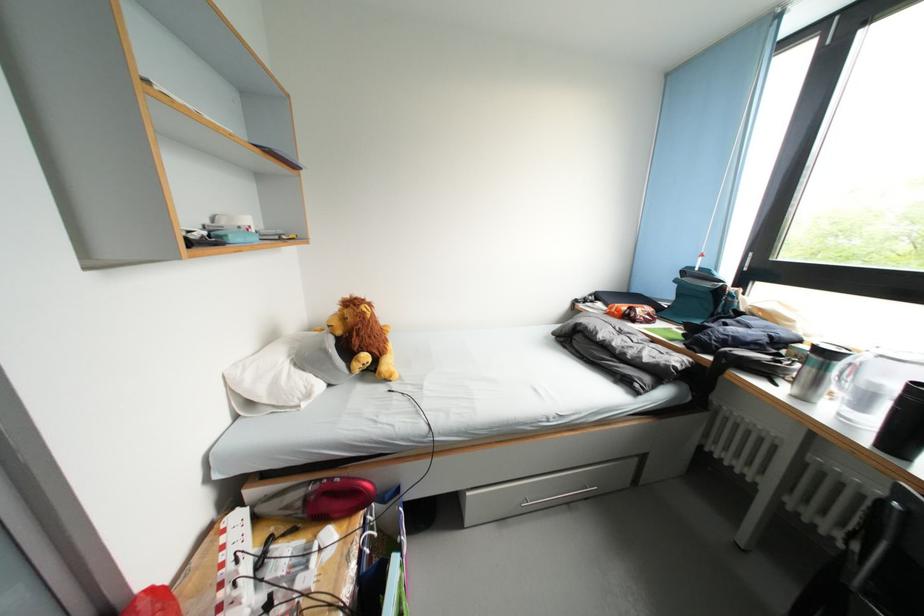
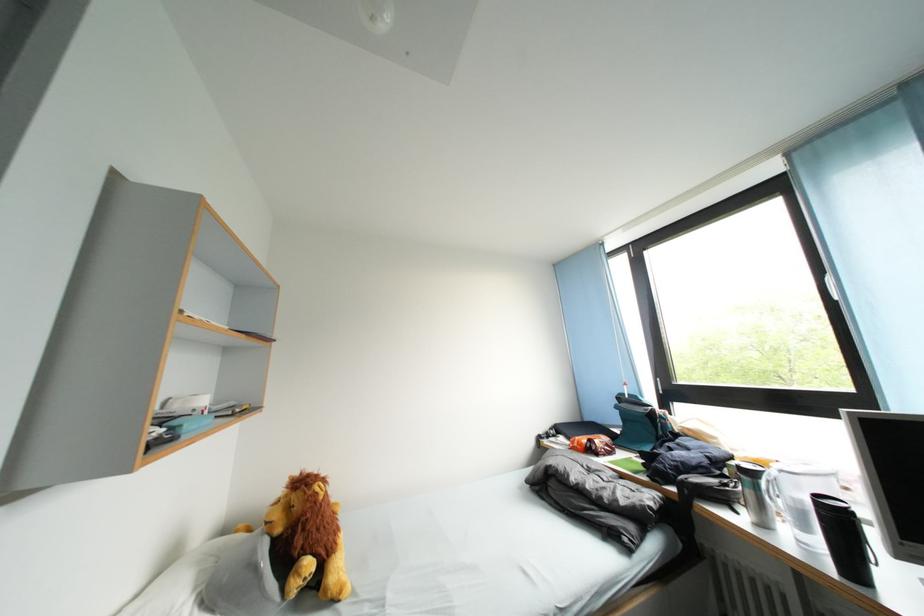
Question: I am providing you with two images of the same scene from different viewpoints. After the viewpoint changes to image2, which objects are now occluded?

Choices:
 (A) silver travel mug
 (B) clear pitcher
 (C) white window handle
 (D) none of these

Answer: (D)